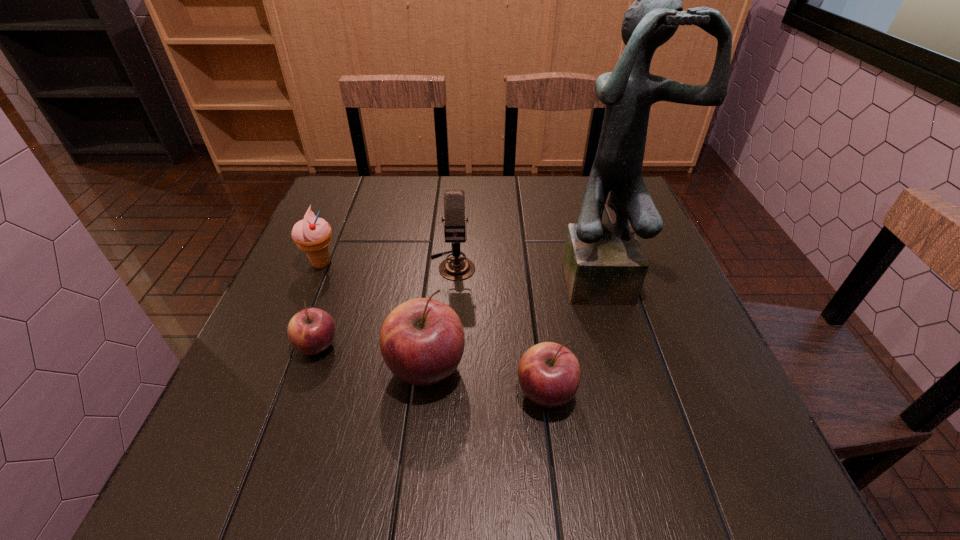
Image resolution: width=960 pixels, height=540 pixels. I want to click on vacant space located on the back of the second apple from right to left, so click(442, 225).

Where is `vacant space located on the back of the rightmost apple`? The height and width of the screenshot is (540, 960). vacant space located on the back of the rightmost apple is located at coordinates (527, 245).

Identify the location of free spot located 0.260m on the face of the rightmost object. The height and width of the screenshot is (540, 960). (649, 417).

Where is `free spot located 0.050m on the front-facing side of the microphone`? free spot located 0.050m on the front-facing side of the microphone is located at coordinates (450, 296).

Locate an element on the screen. This screenshot has width=960, height=540. blank space located on the back of the icecream is located at coordinates (353, 187).

I want to click on apple that is at the left edge, so click(x=311, y=331).

Image resolution: width=960 pixels, height=540 pixels. Find the location of `icecream at the left edge`. icecream at the left edge is located at coordinates (312, 234).

At what (x,y) coordinates should I click in order to perform the action: click on object situated at the right edge. Please return your answer as a coordinate pair (x, y). The width and height of the screenshot is (960, 540). Looking at the image, I should click on (604, 264).

The width and height of the screenshot is (960, 540). What are the coordinates of `vacant space at the far edge` in the screenshot? It's located at (414, 191).

Where is `free space at the near edge`? The image size is (960, 540). free space at the near edge is located at coordinates pos(382,400).